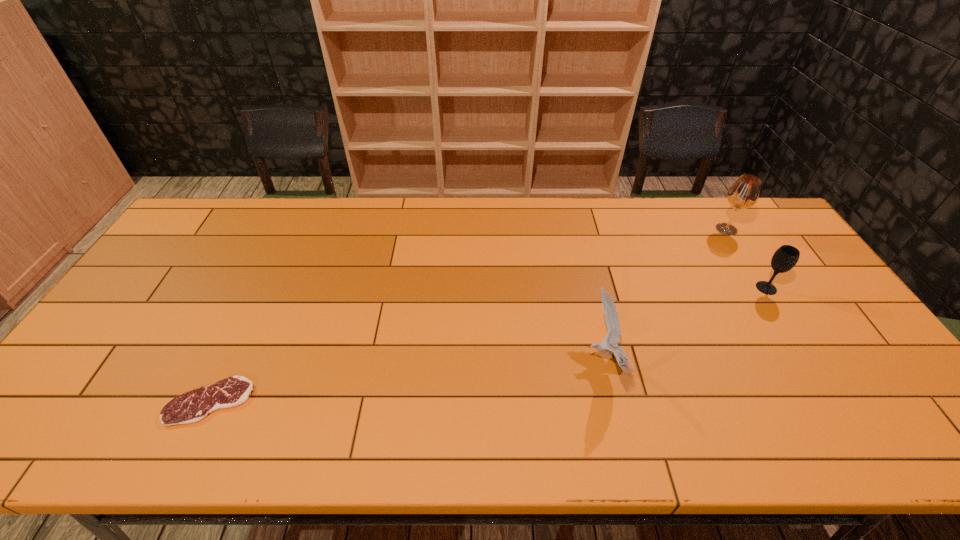
The width and height of the screenshot is (960, 540). I want to click on free space at the near left corner, so [x=67, y=438].

This screenshot has height=540, width=960. In order to click on vacant point located between the farthest object and the second object from left to right in this screenshot , I will do `click(666, 294)`.

This screenshot has height=540, width=960. What are the coordinates of `free space between the taller wineglass and the shorter wineglass` in the screenshot? It's located at tap(746, 259).

Where is `empty space that is in between the farthest object and the nearer wineglass`? empty space that is in between the farthest object and the nearer wineglass is located at coordinates coord(746,259).

In order to click on free space between the shorter wineglass and the farther wineglass in this screenshot , I will do pyautogui.click(x=746, y=259).

Locate an element on the screen. The image size is (960, 540). unoccupied area between the steak and the taller wineglass is located at coordinates (468, 315).

This screenshot has height=540, width=960. In order to click on blank region between the gull and the farthest object in this screenshot , I will do `click(666, 294)`.

Find the location of a particular element. The width and height of the screenshot is (960, 540). free space between the third nearest object and the farthest object is located at coordinates (746, 259).

The image size is (960, 540). I want to click on vacant area that lies between the nearer wineglass and the steak, so click(488, 345).

Locate an element on the screen. Image resolution: width=960 pixels, height=540 pixels. vacant space that is in between the second object from left to right and the taller wineglass is located at coordinates (666, 294).